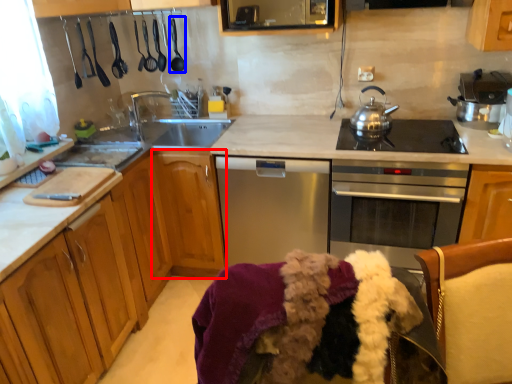
Question: Which point is closer to the camera, cabinetry (highlighted by a red box) or appliance (highlighted by a blue box)?

Choices:
 (A) cabinetry
 (B) appliance

Answer: (A)